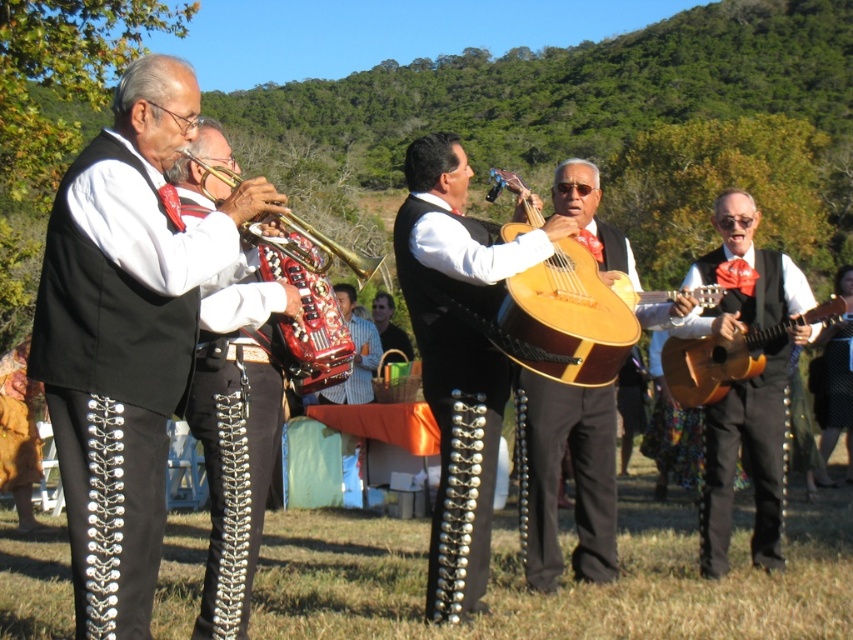
Does shiny gold guitar at center have a lesser height compared to gold plated trumpet at left?

Incorrect, shiny gold guitar at center's height does not fall short of gold plated trumpet at left's.

Which is more to the right, shiny gold guitar at center or gold plated trumpet at left?

shiny gold guitar at center is more to the right.

Does point (517, 244) lie behind point (224, 182)?

Yes, point (517, 244) is behind point (224, 182).

Where is `shiny gold guitar at center`? shiny gold guitar at center is located at coordinates (457, 355).

How distant is shiny black pants at left from matte brown guitar at right?

A distance of 2.91 meters exists between shiny black pants at left and matte brown guitar at right.

Can you confirm if shiny black pants at left is wider than matte brown guitar at right?

No.

Between point (231, 577) and point (770, 566), which one is positioned behind?

Positioned behind is point (770, 566).

You are a GUI agent. You are given a task and a screenshot of the screen. Output one action in this format:
    pyautogui.click(x=<x>, y=<y>)
    Task: Click on the shiny black pants at left
    This screenshot has height=640, width=853.
    Given the screenshot: What is the action you would take?
    pyautogui.click(x=236, y=445)

Which of these two, wooden acoustic guitar at center or gold plated trumpet at left, stands shorter?

→ With less height is gold plated trumpet at left.

Does wooden acoustic guitar at center have a larger size compared to gold plated trumpet at left?

Correct, wooden acoustic guitar at center is larger in size than gold plated trumpet at left.

Is point (567, 433) positioned behind point (199, 164)?

Yes, point (567, 433) is behind point (199, 164).

Find the location of a particular element. wooden acoustic guitar at center is located at coordinates (573, 477).